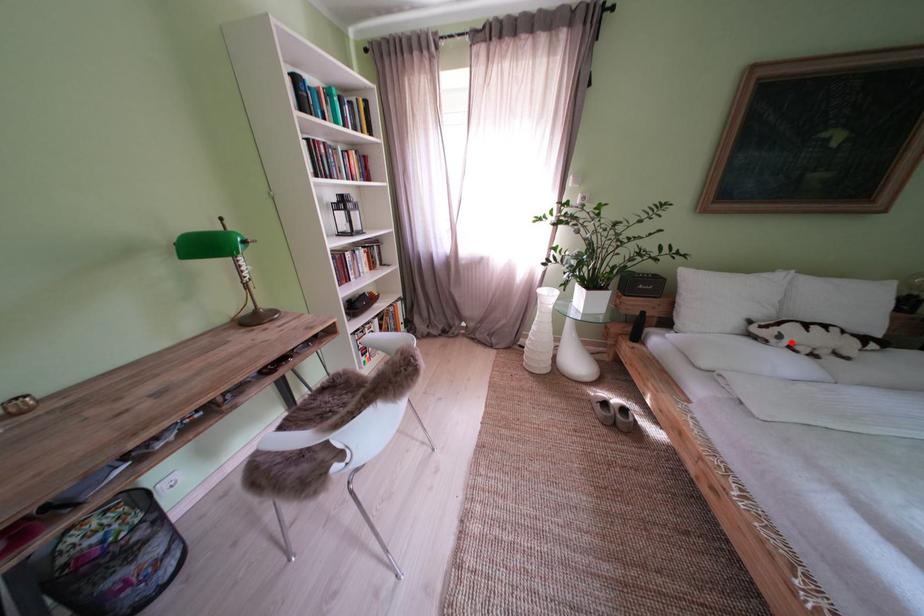
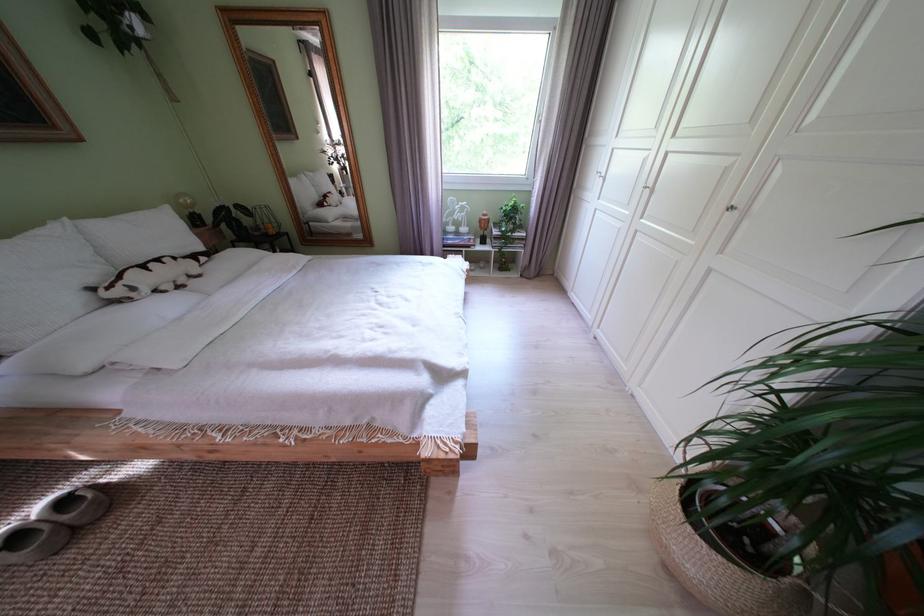
Question: I am providing you with two images of the same scene from different viewpoints. Image1 has a red point marked. In image2, the corresponding 3D location appears at what relative position? Reply with the corresponding letter.

Choices:
 (A) Closer
 (B) Farther

Answer: (B)